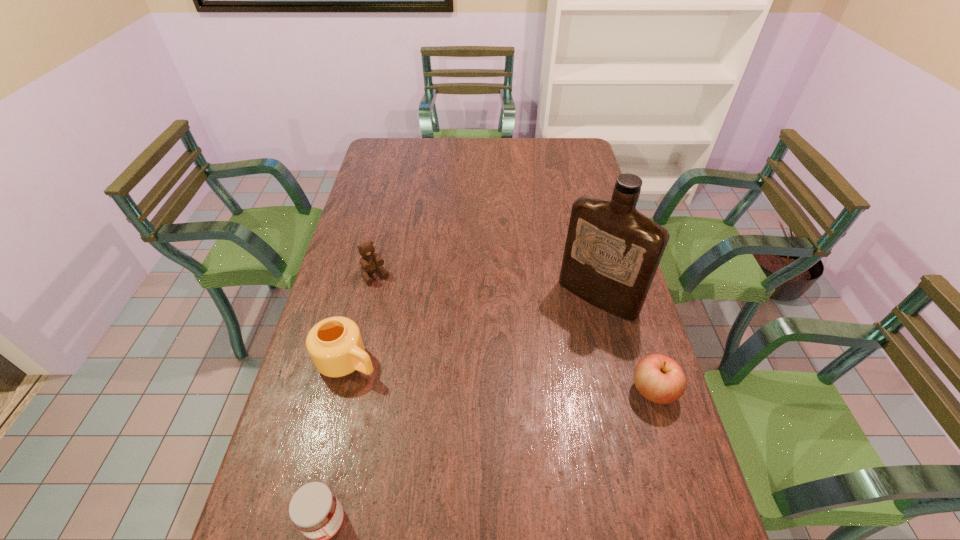
Locate an element on the screen. The width and height of the screenshot is (960, 540). vacant space on the desktop that is between the nearest object and the apple and is positioned on the label side of the tallest object is located at coordinates (462, 468).

You are a GUI agent. You are given a task and a screenshot of the screen. Output one action in this format:
    pyautogui.click(x=<x>, y=<y>)
    Task: Click on the free spot on the desktop that is between the nearest object and the apple and is positioned on the handle side of the mug
    This screenshot has width=960, height=540.
    Given the screenshot: What is the action you would take?
    pyautogui.click(x=503, y=451)

What are the coordinates of `vacant space on the desktop that is between the jam and the apple and is positioned on the face of the teddy bear` in the screenshot? It's located at (486, 458).